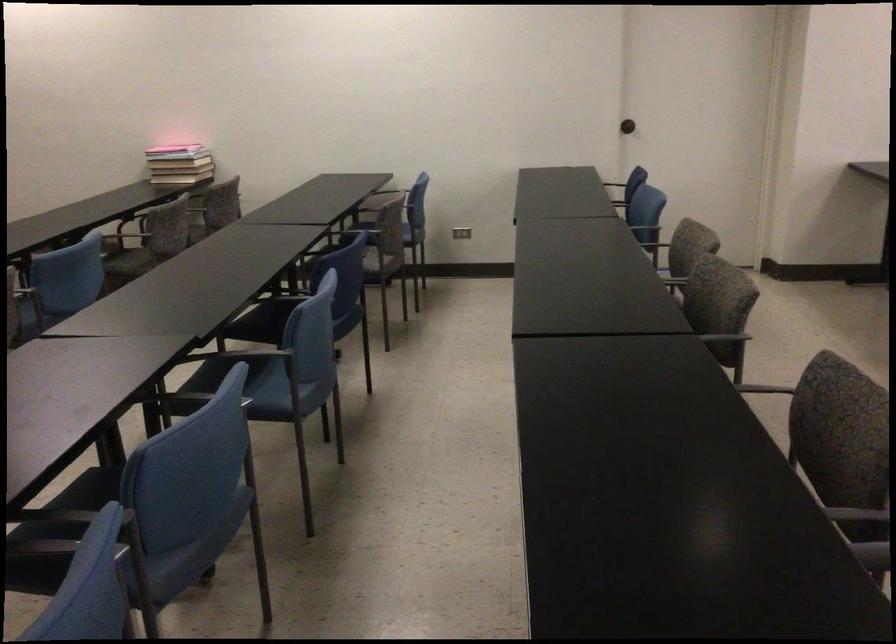
The location [175,147] corresponds to which object?

It corresponds to the pink book in the image.